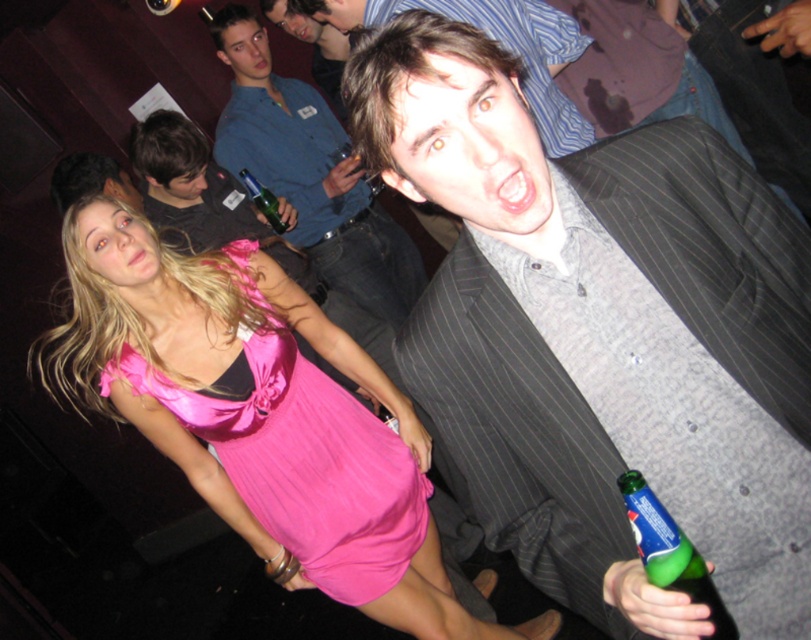
Question: Which point is closer to the camera?

Choices:
 (A) (312, 273)
 (B) (784, 534)

Answer: (B)

Question: Is pink satin dress at lower left below gray pinstripe suit at upper right?

Choices:
 (A) no
 (B) yes

Answer: (B)

Question: Is gray pinstripe suit at center above green glass bottle at lower right?

Choices:
 (A) no
 (B) yes

Answer: (B)

Question: Which point is closer to the camera?

Choices:
 (A) (260, 186)
 (B) (638, 496)
 (C) (320, 177)

Answer: (B)

Question: Based on their relative distances, which object is farther from the green glass bottle at lower right?

Choices:
 (A) gray pinstripe suit at upper right
 (B) green glass bottle at center
 (C) matte black suit at upper right

Answer: (A)

Question: Is gray pinstripe suit at center behind matte black suit at upper right?

Choices:
 (A) yes
 (B) no

Answer: (B)